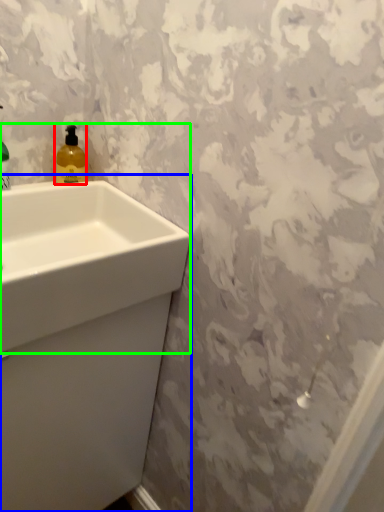
Question: Which object is the closest to the soap dispenser (highlighted by a red box)? Choose among these: sink (highlighted by a blue box) or sink (highlighted by a green box).

Choices:
 (A) sink
 (B) sink

Answer: (B)